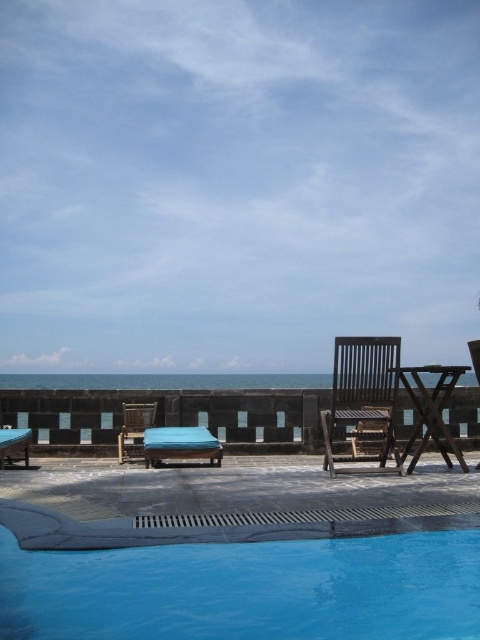
You are standing at the edge of the pool and want to walk to both points marked in the scene. Which point, point (x=307, y=550) or point (x=196, y=433), is closer to you?

Point (x=307, y=550) is closer to the viewer than point (x=196, y=433).

You are planning to place a new rectangular plant pot between the dark brown wooden beach chair at center and the teal fabric chair at center. Given that the plant pot is 1.2 meters wide, can it fit between them without touching either chair?

The dark brown wooden beach chair at center is thinner than the teal fabric chair at center. However, the exact width between them isn t specified. Without knowing the distance between the chairs, it s impossible to determine if the 1.2 meter wide plant pot will fit.

You are standing at the edge of the swimming pool and want to walk to the point marked as point (x=202, y=451). However, there is an obstacle at point (x=128, y=417). Will you pass in front of or behind the obstacle while reaching your destination?

Since point (x=202, y=451) is in front of point (x=128, y=417), you will pass in front of the obstacle at point (x=128, y=417) while walking to your destination at point (x=202, y=451).